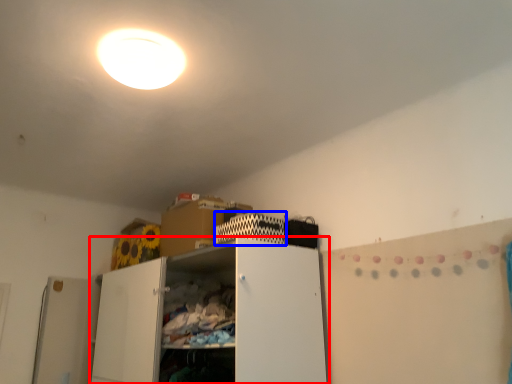
Question: Which object appears closest to the camera in this image, cabinetry (highlighted by a red box) or cabinet (highlighted by a blue box)?

Choices:
 (A) cabinetry
 (B) cabinet

Answer: (A)